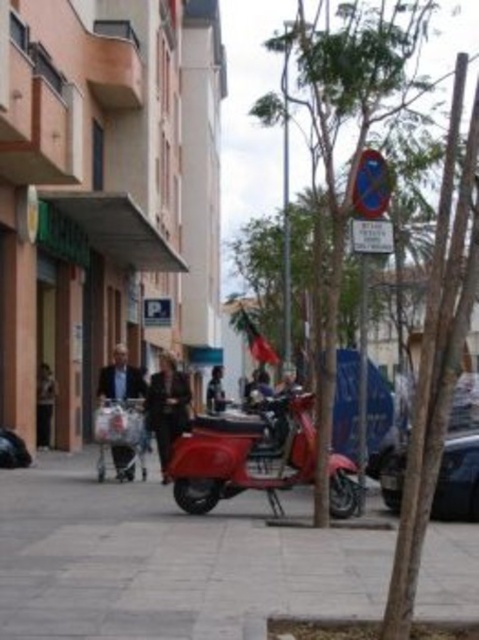
Which is behind, point (264, 112) or point (278, 464)?

Positioned behind is point (264, 112).

Locate an element on the screen. This screenshot has width=479, height=640. green leafy tree at center is located at coordinates (355, 138).

What do you see at coordinates (355, 138) in the screenshot? I see `green leafy tree at center` at bounding box center [355, 138].

Who is higher up, green leafy tree at center or shiny black car at right?

Positioned higher is green leafy tree at center.

The width and height of the screenshot is (479, 640). What are the coordinates of `green leafy tree at center` in the screenshot? It's located at (355, 138).

The width and height of the screenshot is (479, 640). I want to click on green leafy tree at center, so click(x=355, y=138).

Who is shorter, gray concrete pavement at center or shiny black car at right?

gray concrete pavement at center

Based on the photo, can you confirm if gray concrete pavement at center is positioned above shiny black car at right?

No, gray concrete pavement at center is not above shiny black car at right.

Measure the distance between gray concrete pavement at center and camera.

A distance of 5.74 meters exists between gray concrete pavement at center and camera.

The height and width of the screenshot is (640, 479). Find the location of `gray concrete pavement at center`. gray concrete pavement at center is located at coordinates (166, 561).